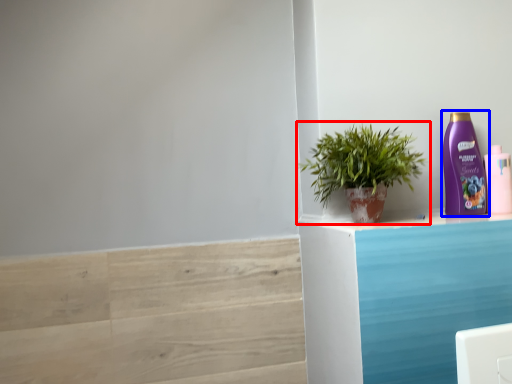
Question: Among these objects, which one is nearest to the camera, houseplant (highlighted by a red box) or bottle (highlighted by a blue box)?

Choices:
 (A) houseplant
 (B) bottle

Answer: (A)